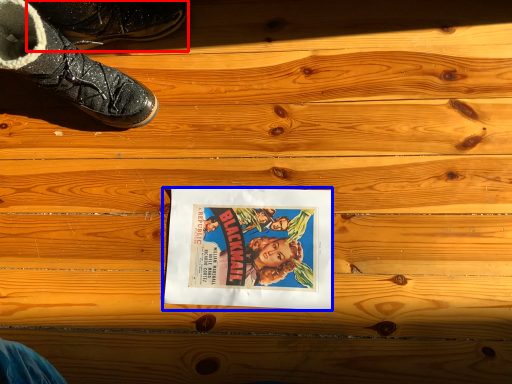
Question: Among these objects, which one is nearest to the camera, footwear (highlighted by a red box) or movie poster (highlighted by a blue box)?

Choices:
 (A) footwear
 (B) movie poster

Answer: (A)